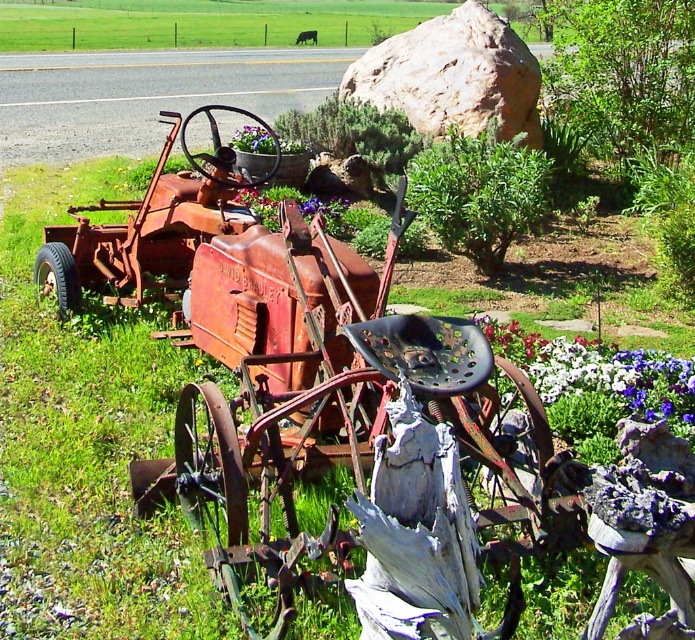
Which is behind, point (250, 176) or point (238, 129)?

Point (238, 129)

Locate an element on the screen. The width and height of the screenshot is (695, 640). purple fabric flower bed at center is located at coordinates (291, 166).

Is rustic stone boulder at center below purple fabric flower at lower right?

No, rustic stone boulder at center is not below purple fabric flower at lower right.

At what (x,y) coordinates should I click in order to perform the action: click on rustic stone boulder at center. Please return your answer as a coordinate pair (x, y). The image size is (695, 640). Looking at the image, I should click on (452, 76).

Is point (393, 86) positioned before point (646, 362)?

No, (393, 86) is further to viewer.

You are a GUI agent. You are given a task and a screenshot of the screen. Output one action in this format:
    pyautogui.click(x=<x>, y=<y>)
    Task: Click on the rustic stone boulder at center
    The height and width of the screenshot is (640, 695).
    Given the screenshot: What is the action you would take?
    pyautogui.click(x=452, y=76)

Can you confirm if purple fabric flower at lower right is bigger than purple fabric flower at center?

Correct, purple fabric flower at lower right is larger in size than purple fabric flower at center.

Which is more to the right, purple fabric flower at lower right or purple fabric flower at center?

purple fabric flower at lower right

Locate an element on the screen. The image size is (695, 640). purple fabric flower at lower right is located at coordinates (600, 371).